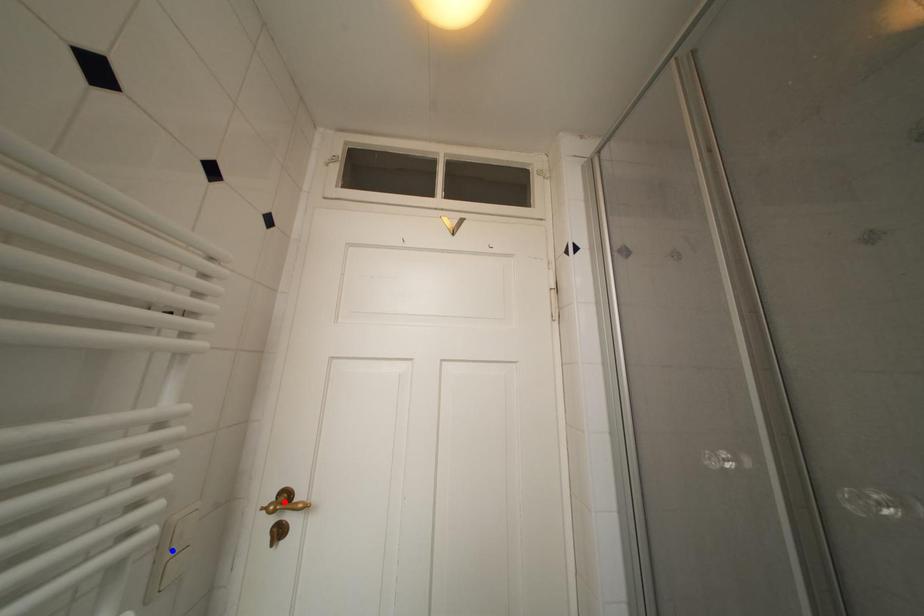
Question: In the image, two points are highlighted. Which point is nearer to the camera? Reply with the corresponding letter.

Choices:
 (A) blue point
 (B) red point

Answer: (A)